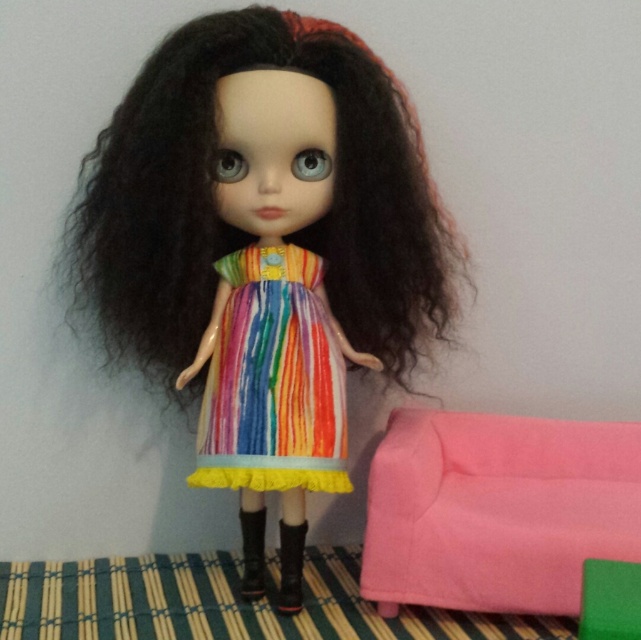
Question: Where is rainbow striped fabric dress at center located in relation to black leather boot at lower center in the image?

Choices:
 (A) below
 (B) above

Answer: (B)

Question: Among these objects, which one is nearest to the camera?

Choices:
 (A) leather boot at center
 (B) matte plastic doll at center

Answer: (B)

Question: Which object appears farthest from the camera in this image?

Choices:
 (A) leather boot at center
 (B) matte plastic doll at center
 (C) pink fabric couch at lower right

Answer: (A)

Question: Among these points, which one is nearest to the camera?

Choices:
 (A) (631, 609)
 (B) (285, 564)
 (C) (115, 218)

Answer: (A)

Question: Does pink fabric couch at lower right appear on the left side of green plastic stool at lower right?

Choices:
 (A) yes
 (B) no

Answer: (A)

Question: Does pink fabric couch at lower right appear on the left side of black leather boot at lower center?

Choices:
 (A) no
 (B) yes

Answer: (A)